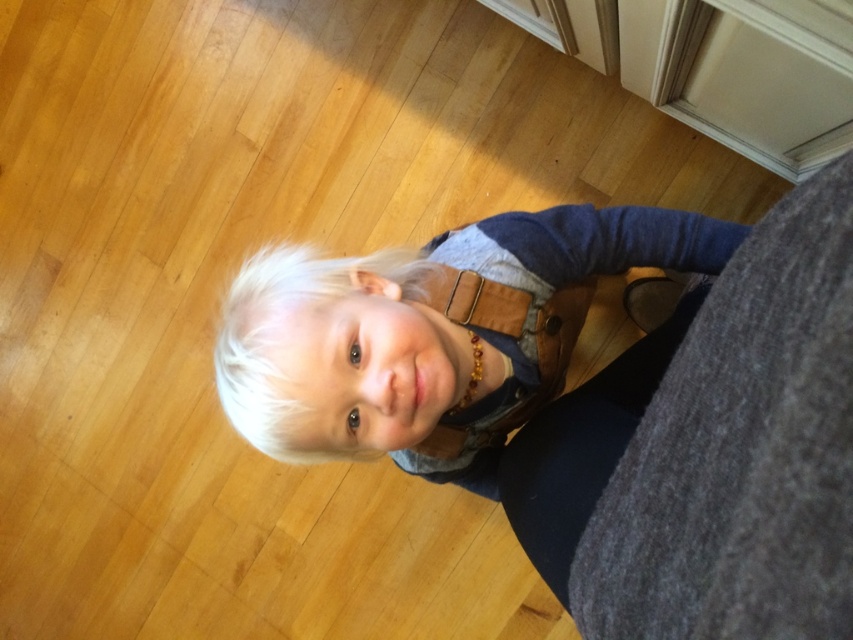
Based on the scene description, where is the blonde hair at center positioned in terms of coordinates?

The blonde hair at center is located at point (296, 348).

You are a photographer setting up for a portrait. The subject is the child standing on the wooden floor. You need to place a matte brown leather bag in the scene so that it is exactly 24.32 inches away from the camera. Where should you position the matte brown leather bag at center in relation to the child?

The matte brown leather bag at center should be positioned 24.32 inches away from the camera, directly in front of or near the child to maintain the specified distance while keeping it within the scene context.

The child is wearing a brown leather belt at center and has blonde hair at center. Which of these is located higher on the child?

The brown leather belt at center is located higher than the blonde hair at center because the blonde hair at center is positioned under the brown leather belt at center.